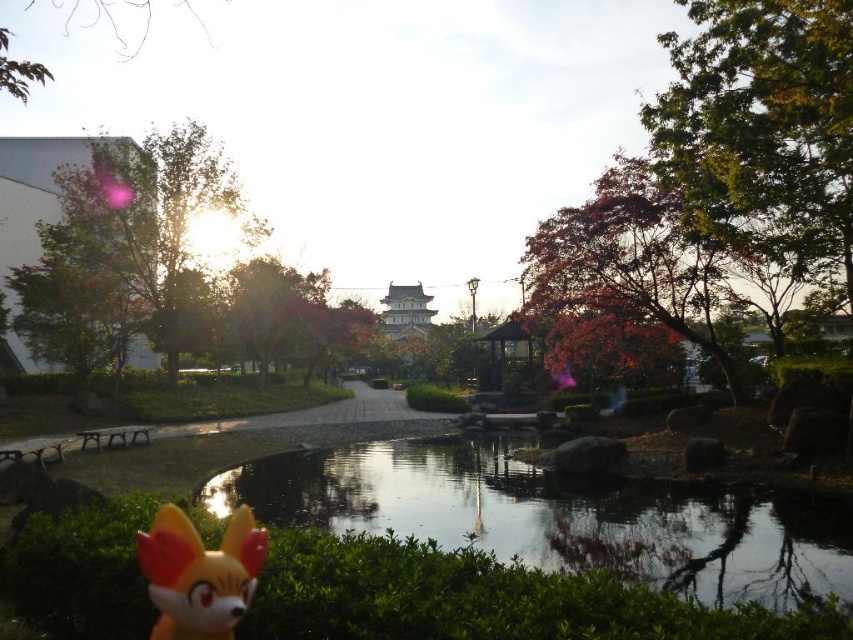
You are a child who wants to play with the matte orange plush toy at lower left. You are currently standing next to the transparent glass water at center. Which direction should you move to reach the toy?

The transparent glass water at center is taller than matte orange plush toy at lower left. Since the toy is at lower left, you should move towards the lower left direction to reach it.